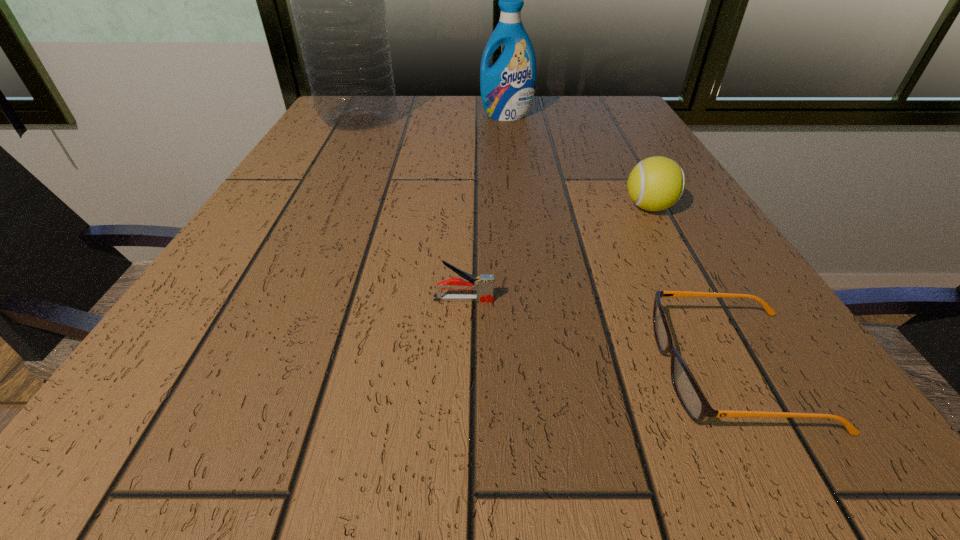
I want to click on water jug, so click(337, 0).

Where is `the tallest object`? The image size is (960, 540). the tallest object is located at coordinates (337, 0).

What are the coordinates of `detergent` in the screenshot? It's located at (507, 87).

Where is `tennis ball`? Image resolution: width=960 pixels, height=540 pixels. tennis ball is located at coordinates (656, 183).

Identify the location of the third shortest object. This screenshot has width=960, height=540. (656, 183).

At what (x,y) coordinates should I click in order to perform the action: click on the second shortest object. Please return your answer as a coordinate pair (x, y). Looking at the image, I should click on (484, 284).

Find the location of `the second nearest object`. the second nearest object is located at coordinates (484, 284).

The height and width of the screenshot is (540, 960). What are the coordinates of `the nearest object` in the screenshot? It's located at (694, 403).

Find the location of a particular element. The image size is (960, 540). spectacles is located at coordinates (694, 403).

You are a GUI agent. You are given a task and a screenshot of the screen. Output one action in this format:
    pyautogui.click(x=<x>, y=<y>)
    Task: Click on the vacant space located on the front of the leftmost object
    This screenshot has width=960, height=540.
    Given the screenshot: What is the action you would take?
    pyautogui.click(x=295, y=238)